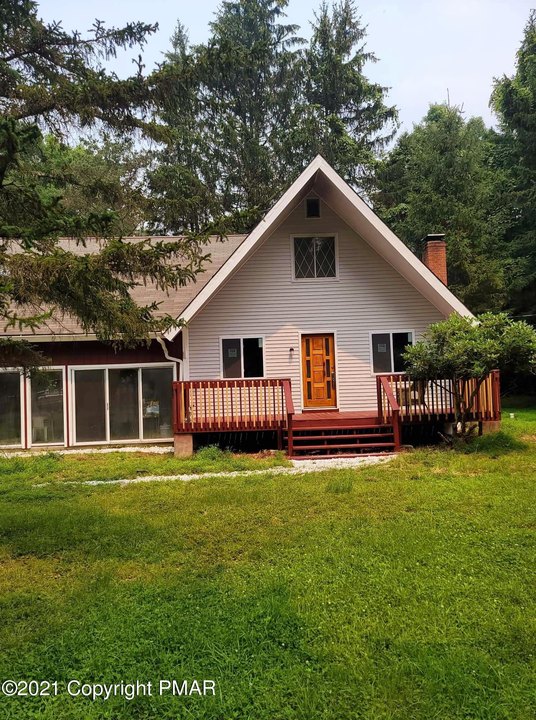
Where is `stairs`? Image resolution: width=536 pixels, height=720 pixels. stairs is located at coordinates (312, 440).